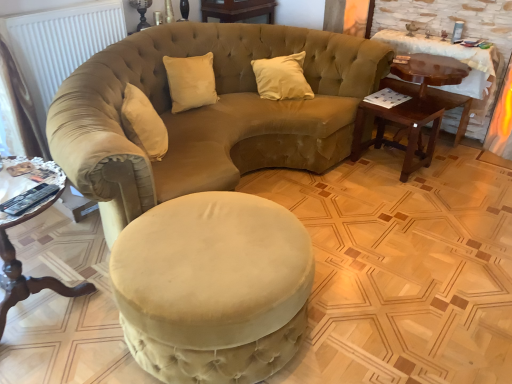
What are the coordinates of `vacant space behind wooden round table at lower left, which ranks as the 3th table in right-to-left order` in the screenshot? It's located at (67, 245).